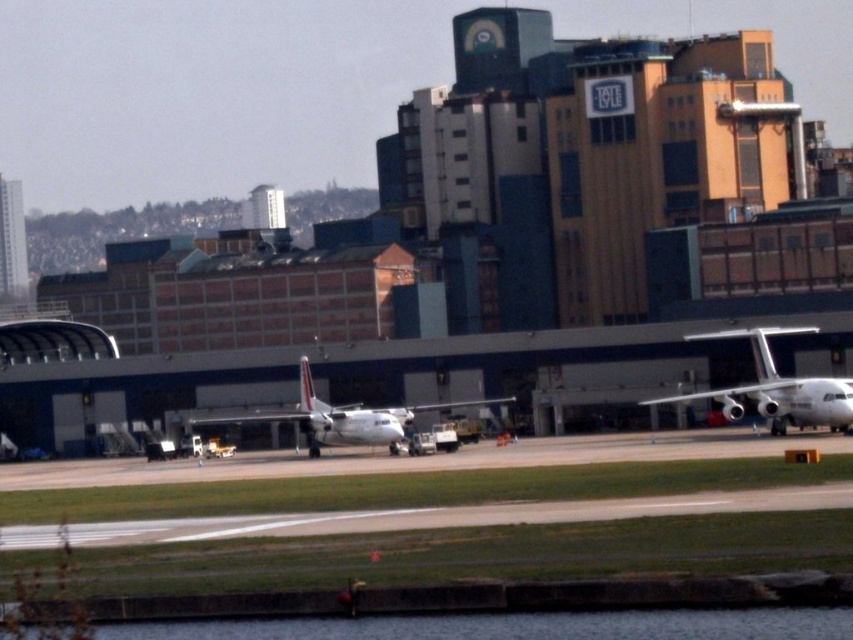
You are a pilot preparing to taxi your plane to the gate. You see the smooth asphalt runway at center and the white matte airplane at center. Which direction should you move your plane to align with the runway?

You should move your plane to the right to align with the smooth asphalt runway at center since the runway is to the right of the white matte airplane at center.

You are a pilot preparing for takeoff and need to know the position of the runway relative to your airplane. Based on the scene, where is the smooth asphalt runway at center in relation to the white glossy airplane at right?

The smooth asphalt runway at center is located below the white glossy airplane at right, meaning the runway is positioned underneath the airplane, likely indicating it is directly beneath it in the image.